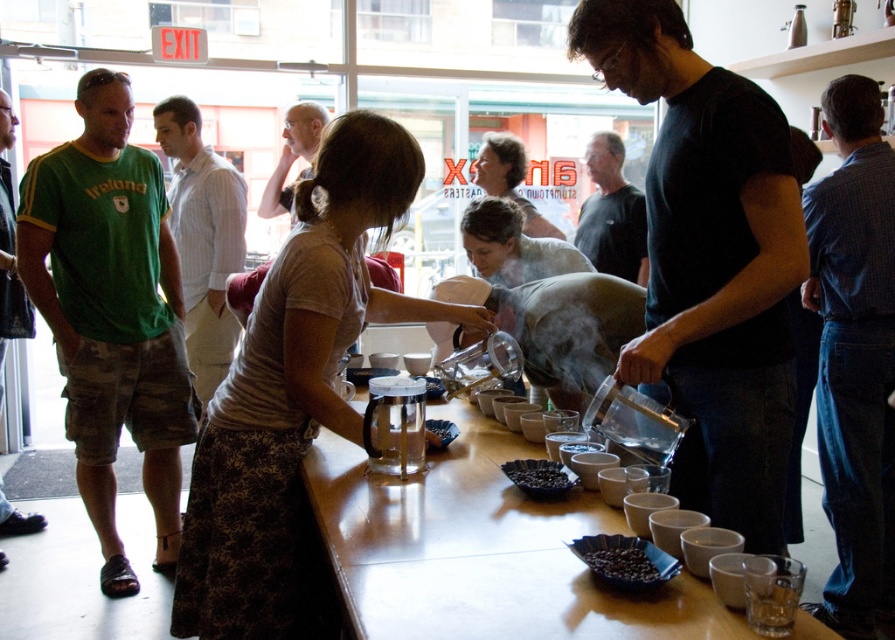
Based on the photo, which is more to the left, black matte pitcher at center or black matte coffee beans at center?

Positioned to the left is black matte coffee beans at center.

Does black matte pitcher at center appear on the left side of black matte coffee beans at center?

Incorrect, black matte pitcher at center is not on the left side of black matte coffee beans at center.

Is point (712, 195) positioned before point (510, 472)?

Yes, it is.

Locate an element on the screen. black matte pitcher at center is located at coordinates (710, 260).

Which is in front, point (4, 128) or point (629, 538)?

Point (629, 538) is in front.

How distant is green cotton t-shirt at left from dark matte coffee beans at center?

green cotton t-shirt at left and dark matte coffee beans at center are 9.07 feet apart.

Measure the distance between green cotton t-shirt at left and camera.

green cotton t-shirt at left is 2.92 meters from camera.

Locate an element on the screen. green cotton t-shirt at left is located at coordinates (9, 248).

Does wooden table at center have a lesser width compared to green camouflage shorts at left?

No.

The image size is (895, 640). What do you see at coordinates (482, 550) in the screenshot?
I see `wooden table at center` at bounding box center [482, 550].

Locate an element on the screen. wooden table at center is located at coordinates pos(482,550).